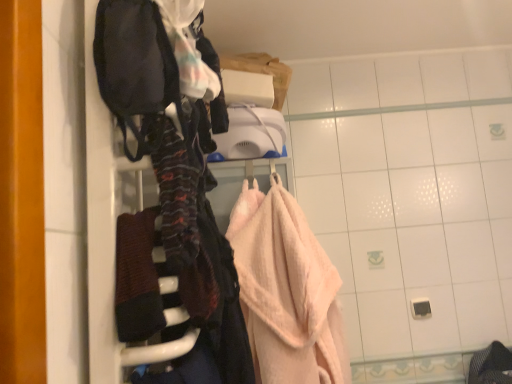
Based on the photo, measure the distance between point (239,272) and camera.

They are 1.16 meters apart.

In order to face dark brown textured towel at center, should I rotate leftwards or rightwards?

Turn left by 15.425 degrees to look at dark brown textured towel at center.

Describe the element at coordinates (167, 206) in the screenshot. The width and height of the screenshot is (512, 384). I see `velvet dark bag at left` at that location.

In order to click on pink terry cloth towel at center in this screenshot , I will do `click(286, 290)`.

Measure the distance between pink terry cloth towel at center and velvet dark bag at left.

They are 17.62 inches apart.

Which object is positioned more to the right, pink terry cloth towel at center or velvet dark bag at left?

From the viewer's perspective, pink terry cloth towel at center appears more on the right side.

From a real-world perspective, which object stands above the other?

velvet dark bag at left, from a real-world perspective.

Is pink terry cloth towel at center far away from velvet dark bag at left?

No.

From the image's perspective, does dark brown textured towel at center appear lower than pink terry cloth towel at center?

Incorrect, from the image's perspective, dark brown textured towel at center is higher than pink terry cloth towel at center.

Considering the positions of objects dark brown textured towel at center and pink terry cloth towel at center in the image provided, who is more to the right, dark brown textured towel at center or pink terry cloth towel at center?

pink terry cloth towel at center.

Is dark brown textured towel at center positioned with its back to pink terry cloth towel at center?

dark brown textured towel at center does not have its back to pink terry cloth towel at center.

From the image's perspective, is pink terry cloth towel at center located above or below dark brown textured towel at center?

Clearly, from the image's perspective, pink terry cloth towel at center is below dark brown textured towel at center.

Considering the sizes of objects pink terry cloth towel at center and dark brown textured towel at center in the image provided, who is wider, pink terry cloth towel at center or dark brown textured towel at center?

pink terry cloth towel at center.

Is dark brown textured towel at center at the back of pink terry cloth towel at center?

pink terry cloth towel at center does not have its back to dark brown textured towel at center.

Is the position of pink terry cloth towel at center more distant than that of dark brown textured towel at center?

Yes, pink terry cloth towel at center is behind dark brown textured towel at center.

Is velvet dark bag at left positioned before pink terry cloth towel at center?

Yes.

This screenshot has width=512, height=384. Find the location of `towel located behind the velvet dark bag at left`. towel located behind the velvet dark bag at left is located at coordinates (286, 290).

Is there a large distance between velvet dark bag at left and pink terry cloth towel at center?

velvet dark bag at left is near pink terry cloth towel at center, not far away.

Image resolution: width=512 pixels, height=384 pixels. What are the coordinates of `bath towel below the velvet dark bag at left (from a real-world perspective)` in the screenshot? It's located at (137, 278).

From a real-world perspective, is velvet dark bag at left under dark brown textured towel at center?

No.

Which object is closer to the camera taking this photo, velvet dark bag at left or dark brown textured towel at center?

velvet dark bag at left.

Is velvet dark bag at left looking in the opposite direction of dark brown textured towel at center?

Yes, dark brown textured towel at center is at the back of velvet dark bag at left.

From the image's perspective, who appears lower, dark brown textured towel at center or velvet dark bag at left?

dark brown textured towel at center.

Is dark brown textured towel at center in front of or behind velvet dark bag at left in the image?

In the image, dark brown textured towel at center appears behind velvet dark bag at left.

Who is bigger, dark brown textured towel at center or velvet dark bag at left?

Bigger between the two is velvet dark bag at left.

Are dark brown textured towel at center and velvet dark bag at left far apart?

Actually, dark brown textured towel at center and velvet dark bag at left are a little close together.

Where is `closet above the pink terry cloth towel at center (from a real-world perspective)`? This screenshot has width=512, height=384. closet above the pink terry cloth towel at center (from a real-world perspective) is located at coordinates (167, 206).

Identify the location of towel lying on the right of dark brown textured towel at center. The height and width of the screenshot is (384, 512). (286, 290).

Based on their spatial positions, is velvet dark bag at left or dark brown textured towel at center closer to pink terry cloth towel at center?

velvet dark bag at left is closer to pink terry cloth towel at center.

Estimate the real-world distances between objects in this image. Which object is closer to pink terry cloth towel at center, dark brown textured towel at center or velvet dark bag at left?

velvet dark bag at left.

Based on their spatial positions, is dark brown textured towel at center or pink terry cloth towel at center closer to velvet dark bag at left?

dark brown textured towel at center lies closer to velvet dark bag at left than the other object.

From the image, which object appears to be nearer to dark brown textured towel at center, velvet dark bag at left or pink terry cloth towel at center?

velvet dark bag at left.

Estimate the real-world distances between objects in this image. Which object is further from velvet dark bag at left, pink terry cloth towel at center or dark brown textured towel at center?

Based on the image, pink terry cloth towel at center appears to be further to velvet dark bag at left.

Which object lies nearer to the anchor point dark brown textured towel at center, pink terry cloth towel at center or velvet dark bag at left?

velvet dark bag at left lies closer to dark brown textured towel at center than the other object.

Locate an element on the screen. This screenshot has height=384, width=512. bath towel between velvet dark bag at left and pink terry cloth towel at center from front to back is located at coordinates (137, 278).